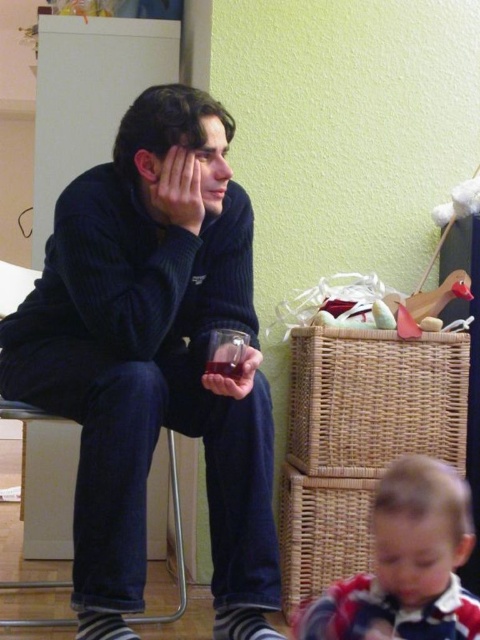
You are a photographer trying to capture a clear shot of the translucent plastic cup at lower center. However, the dark corduroy sweater at left is blocking your view. Can you move the cup or the sweater to get an unobstructed view?

The dark corduroy sweater at left is in front of the translucent plastic cup at lower center. To get an unobstructed view of the cup, you would need to move the dark corduroy sweater at left out of the way since it is blocking the cup.

You are a fashion designer observing the scene. You need to determine which item, the dark corduroy sweater at left or the dark blue corduroy chair at left, requires more fabric to produce. Based on the scene, which one would you choose?

The dark corduroy sweater at left has a larger size compared to the dark blue corduroy chair at left, so it requires more fabric to produce.

From the picture: You are standing in the room and want to reach both the point at coordinates (192,204) and the point at coordinates (204,381). Which point should you reach first to ensure you can access both without moving your position?

You should reach the point at coordinates (192,204) first because it is closer to you than the point at coordinates (204,381), so accessing it first allows you to then reach the farther point without moving.